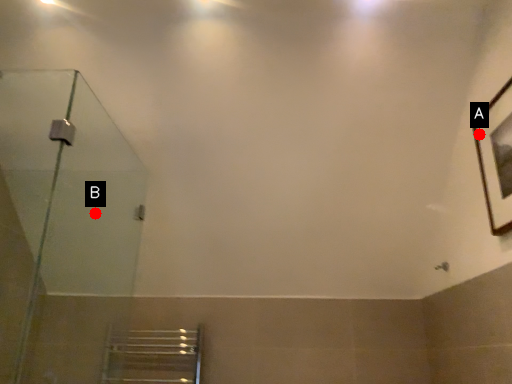
Question: Two points are circled on the image, labeled by A and B beside each circle. Among these points, which one is nearest to the camera?

Choices:
 (A) A is closer
 (B) B is closer

Answer: (A)